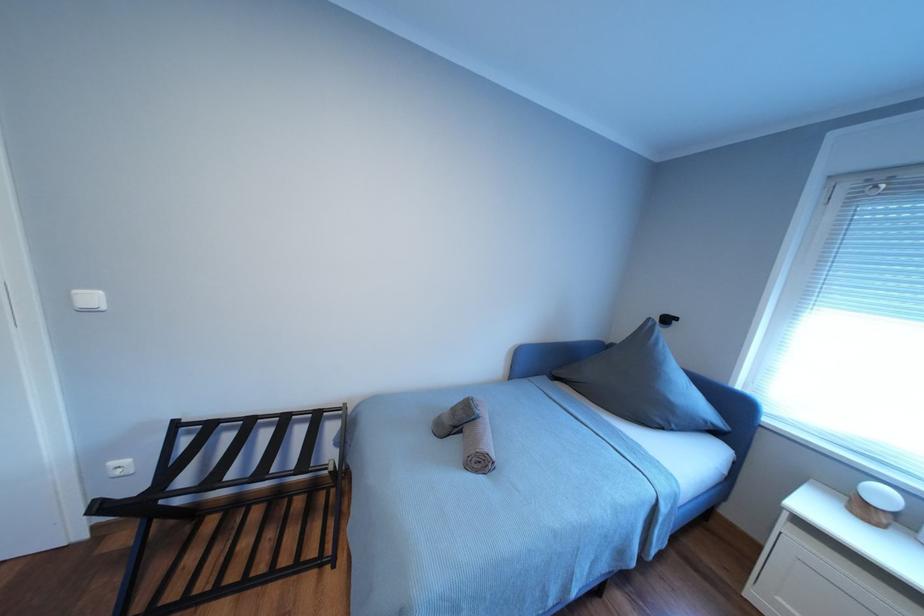
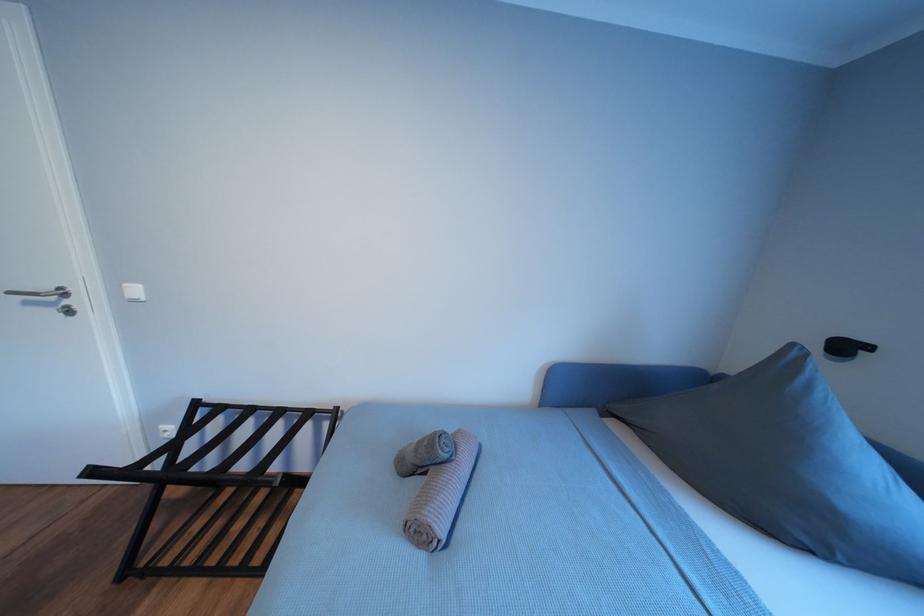
In the scene shown: In a continuous first-person perspective shot, in which direction is the camera moving?

The movement direction of the cameraman is right, forward.